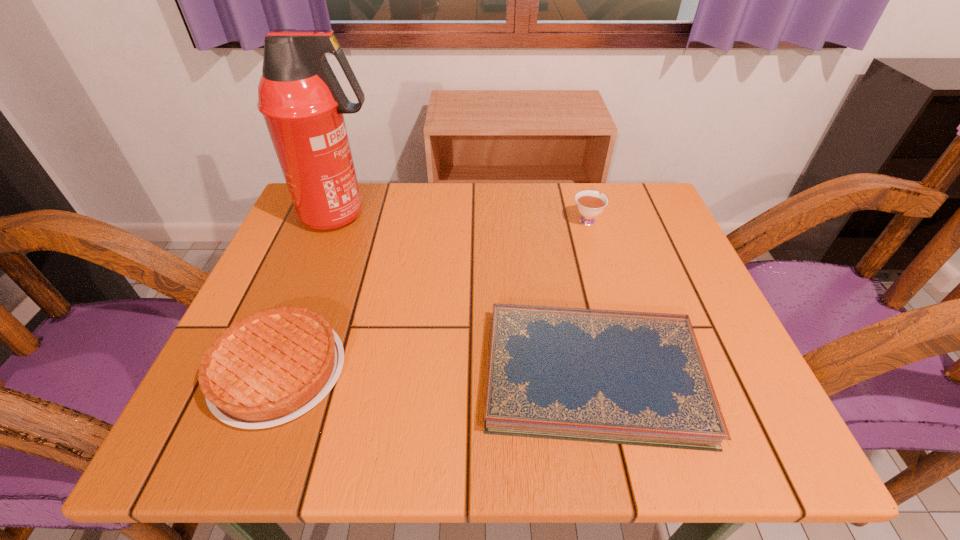
Identify the location of the tallest object. (302, 102).

The image size is (960, 540). Identify the location of teacup. [x=589, y=203].

In order to click on the second shortest object in this screenshot , I will do `click(270, 367)`.

Find the location of a particular element. The image size is (960, 540). the shortest object is located at coordinates (639, 378).

You are a GUI agent. You are given a task and a screenshot of the screen. Output one action in this format:
    pyautogui.click(x=<x>, y=<y>)
    Task: Click on the blank space located on the trigger side of the fire extinguisher
    
    Given the screenshot: What is the action you would take?
    pyautogui.click(x=486, y=215)

Locate an element on the screen. The height and width of the screenshot is (540, 960). blank area located 0.060m on the side of the teacup with the handle is located at coordinates (580, 196).

At what (x,y) coordinates should I click in order to perform the action: click on vacant area situated on the side of the teacup with the handle. Please return your answer as a coordinate pair (x, y). The image size is (960, 540). Looking at the image, I should click on (576, 184).

The height and width of the screenshot is (540, 960). Find the location of `vacant position located on the side of the teacup with the handle`. vacant position located on the side of the teacup with the handle is located at coordinates (577, 187).

What are the coordinates of `vacant space situated 0.260m on the right of the pie` in the screenshot? It's located at (495, 371).

Identify the location of vacant area situated on the back of the paperback book. Image resolution: width=960 pixels, height=540 pixels. (567, 257).